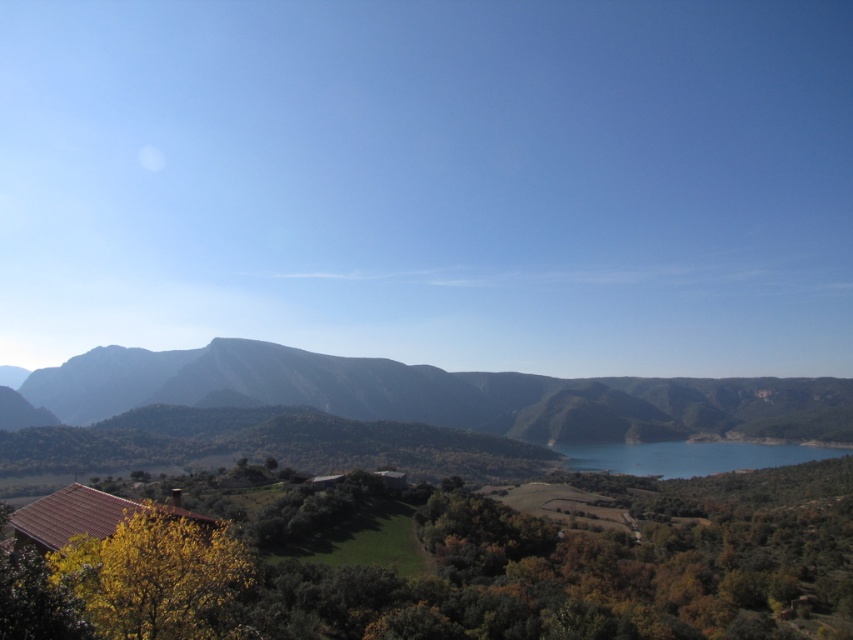
Between rocky gray mountains at center and blue glassy lake at center, which one appears on the left side from the viewer's perspective?

From the viewer's perspective, rocky gray mountains at center appears more on the left side.

Is rocky gray mountains at center bigger than blue glassy lake at center?

Correct, rocky gray mountains at center is larger in size than blue glassy lake at center.

Who is more forward, [334,397] or [627,458]?

Positioned in front is point [627,458].

Identify the location of rocky gray mountains at center. The width and height of the screenshot is (853, 640). (445, 397).